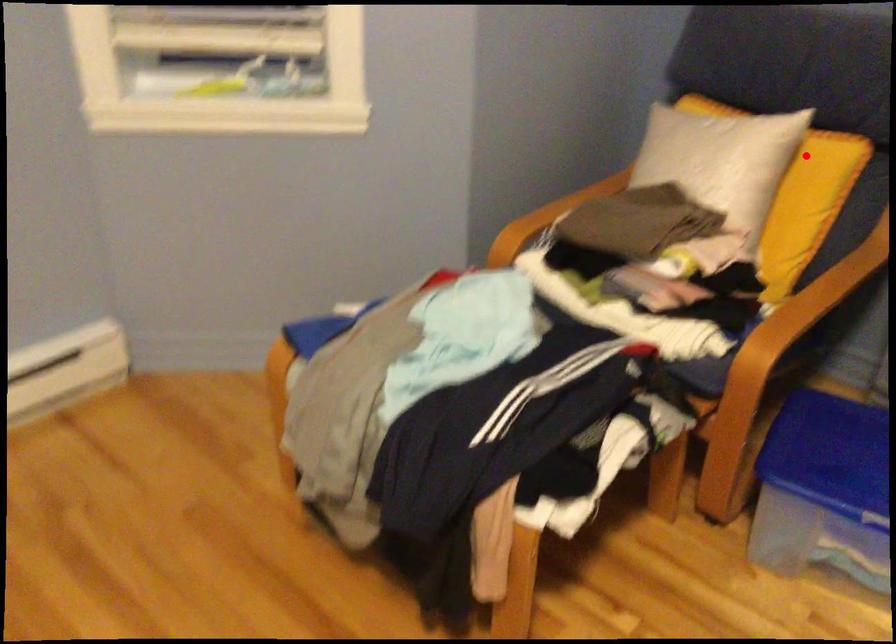
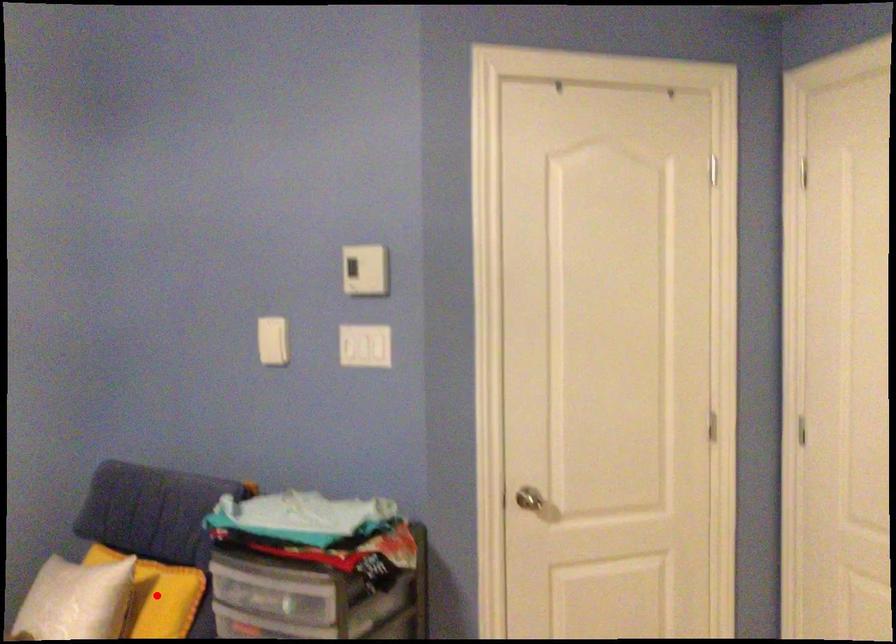
I am providing you with two images of the same scene from different viewpoints. A red point is marked on the first image and another point is marked on the second image. Does the point marked in image1 correspond to the same location as the one in image2?

Yes